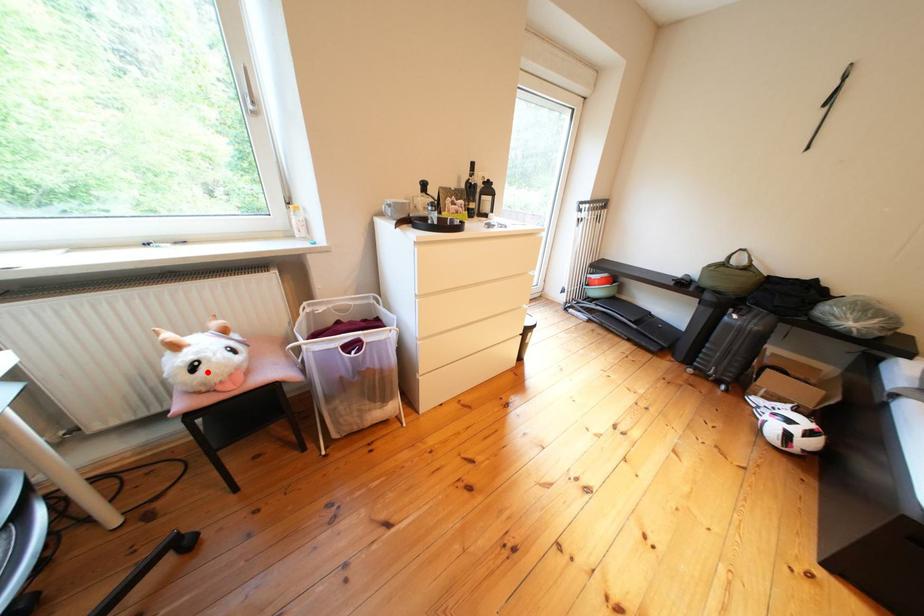
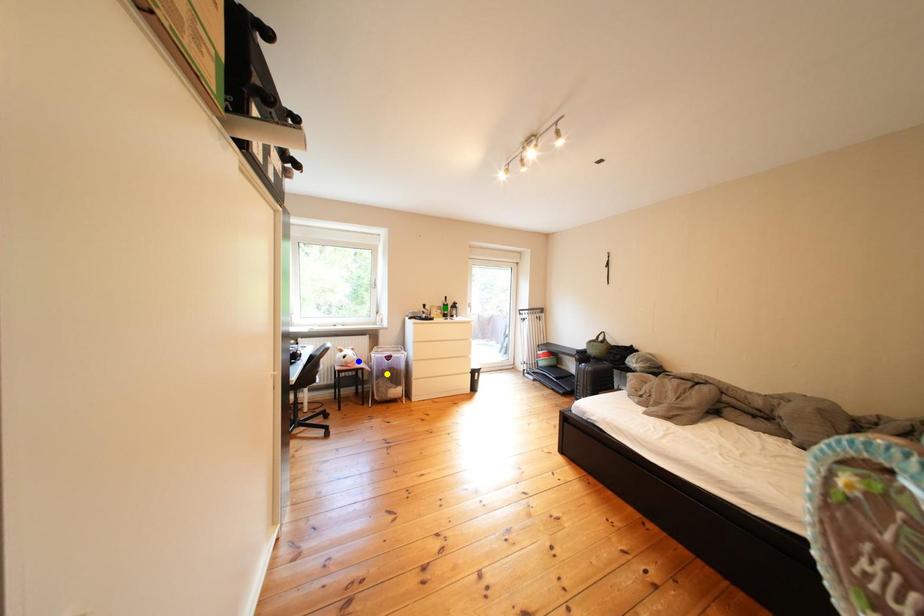
Question: I am providing you with two images of the same scene from different viewpoints. A red point is marked on the first image. You are given multiple points on the second image. In image 2, which mark is for the same physical point as the one in image 1?

Choices:
 (A) yellow point
 (B) blue point
 (C) green point

Answer: (B)